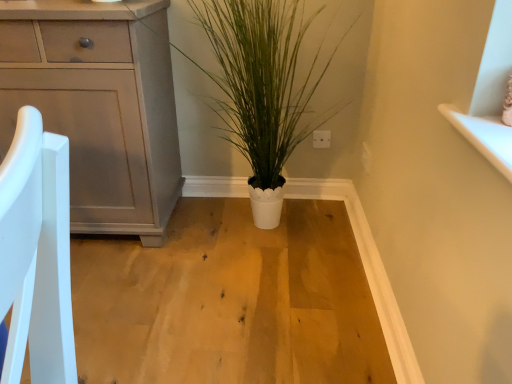
Question: Should I look upward or downward to see white textured pot at center?

Choices:
 (A) down
 (B) up

Answer: (B)

Question: Does white textured pot at center appear on the right side of matte gray cabinet at left?

Choices:
 (A) yes
 (B) no

Answer: (A)

Question: Can matte gray cabinet at left be found inside white textured pot at center?

Choices:
 (A) no
 (B) yes

Answer: (A)

Question: Considering the relative sizes of white textured pot at center and matte gray cabinet at left in the image provided, is white textured pot at center smaller than matte gray cabinet at left?

Choices:
 (A) yes
 (B) no

Answer: (A)

Question: Would you say white textured pot at center is a long distance from matte gray cabinet at left?

Choices:
 (A) no
 (B) yes

Answer: (A)

Question: From the image's perspective, would you say white textured pot at center is positioned over matte gray cabinet at left?

Choices:
 (A) no
 (B) yes

Answer: (B)

Question: Can you confirm if white textured pot at center is taller than matte gray cabinet at left?

Choices:
 (A) no
 (B) yes

Answer: (A)

Question: Is matte gray cabinet at left at the right side of white textured pot at center?

Choices:
 (A) yes
 (B) no

Answer: (B)

Question: Is matte gray cabinet at left beside white textured pot at center?

Choices:
 (A) yes
 (B) no

Answer: (B)

Question: Is matte gray cabinet at left closer to camera compared to white textured pot at center?

Choices:
 (A) no
 (B) yes

Answer: (A)

Question: Considering the relative sizes of matte gray cabinet at left and white textured pot at center in the image provided, is matte gray cabinet at left bigger than white textured pot at center?

Choices:
 (A) no
 (B) yes

Answer: (B)

Question: From a real-world perspective, is matte gray cabinet at left below white textured pot at center?

Choices:
 (A) no
 (B) yes

Answer: (B)

Question: Is there a large distance between matte gray cabinet at left and white textured pot at center?

Choices:
 (A) no
 (B) yes

Answer: (A)

Question: In the image, is matte gray cabinet at left positioned in front of or behind white textured pot at center?

Choices:
 (A) front
 (B) behind

Answer: (B)